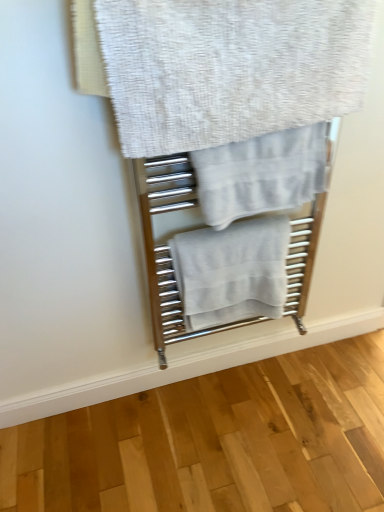
Locate an element on the screen. The height and width of the screenshot is (512, 384). vacant space underneath white cotton towel at center, which is the 1th towel in bottom-to-top order (from a real-world perspective) is located at coordinates (231, 384).